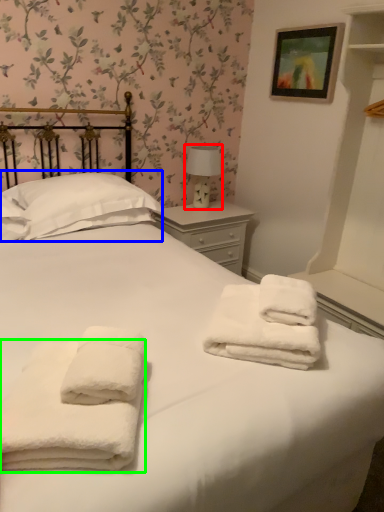
Question: Estimate the real-world distances between objects in this image. Which object is closer to table lamp (highlighted by a red box), pillow (highlighted by a blue box) or towel (highlighted by a green box)?

Choices:
 (A) pillow
 (B) towel

Answer: (A)